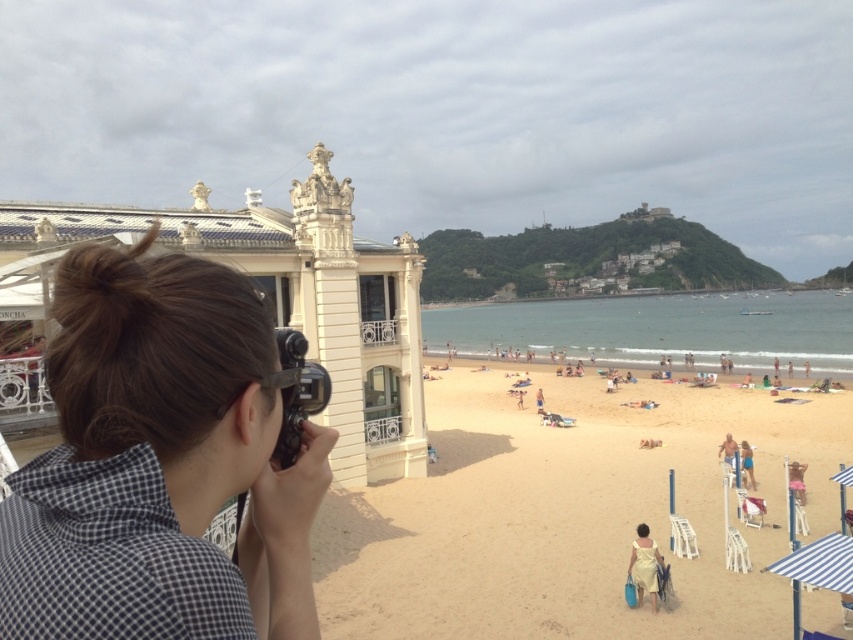
Question: Which object appears farthest from the camera in this image?

Choices:
 (A) black plastic camera at center
 (B) beige fabric towel at lower right
 (C) golden sand beach at center
 (D) yellow fabric dress at lower right

Answer: (B)

Question: Estimate the real-world distances between objects in this image. Which object is closer to the golden sand beach at center?

Choices:
 (A) beige fabric towel at lower right
 (B) black plastic camera at center
 (C) yellow fabric dress at lower right
 (D) checkered fabric hair at center

Answer: (A)

Question: Can you confirm if checkered fabric hair at center is thinner than beige fabric towel at lower right?

Choices:
 (A) yes
 (B) no

Answer: (B)

Question: Which of the following is the farthest from the observer?

Choices:
 (A) checkered fabric hair at center
 (B) beige fabric towel at lower right
 (C) black plastic camera at center
 (D) yellow fabric dress at lower right

Answer: (B)

Question: Is checkered fabric hair at center to the right of black plastic camera at center from the viewer's perspective?

Choices:
 (A) no
 (B) yes

Answer: (B)

Question: Is black plastic camera at center closer to camera compared to beige fabric towel at lower right?

Choices:
 (A) no
 (B) yes

Answer: (B)